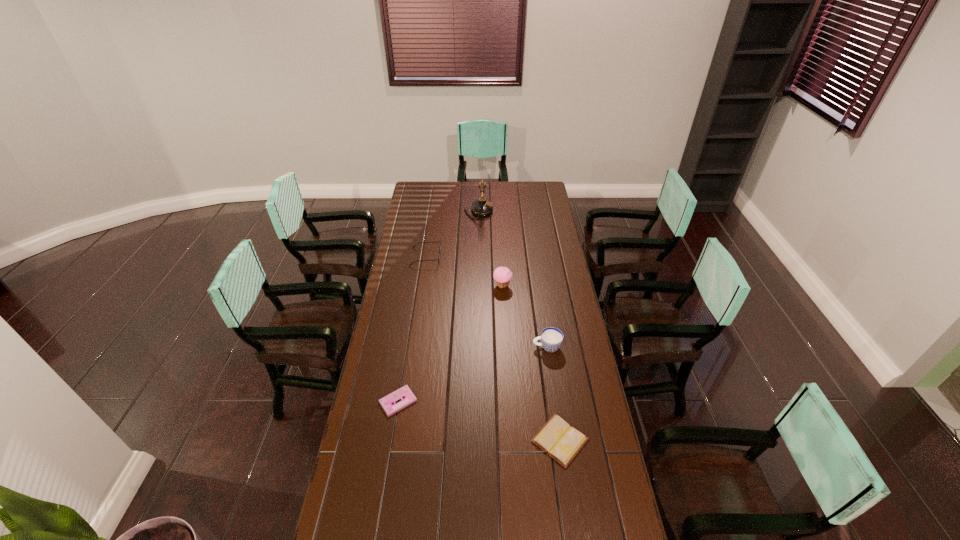
Identify the location of free space located on the dial of the farthest object. The width and height of the screenshot is (960, 540). (503, 212).

Locate an element on the screen. free space located 0.120m on the back of the second tallest object is located at coordinates (501, 264).

What are the coordinates of `vacant space located 0.210m on the side of the cup with the handle` in the screenshot? It's located at (483, 347).

This screenshot has width=960, height=540. Find the location of `free spot located 0.270m on the side of the cup with the handle`. free spot located 0.270m on the side of the cup with the handle is located at coordinates (468, 347).

You are a GUI agent. You are given a task and a screenshot of the screen. Output one action in this format:
    pyautogui.click(x=<x>, y=<y>)
    Task: Click on the vacant space located 0.260m on the side of the cup with the handle
    This screenshot has width=960, height=540.
    Given the screenshot: What is the action you would take?
    pyautogui.click(x=471, y=347)

The image size is (960, 540). I want to click on free space located on the front-facing side of the fifth nearest object, so click(x=454, y=257).

What are the coordinates of `vacant area situated on the back of the diary` in the screenshot? It's located at (548, 358).

The width and height of the screenshot is (960, 540). I want to click on vacant space located on the back of the shortest object, so click(x=411, y=322).

Where is `object situated at the far edge`? object situated at the far edge is located at coordinates (481, 207).

Identify the location of spectacles that is at the left edge. (439, 241).